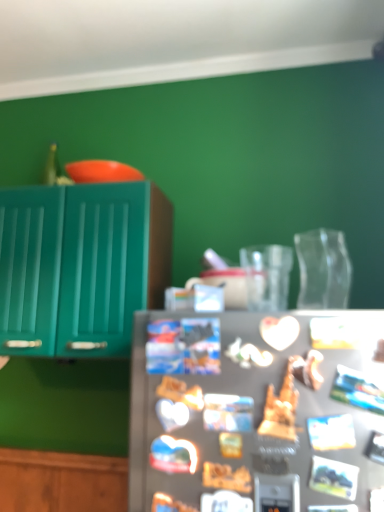
Question: Considering the positions of teal glossy cabinet at left and satin silver fridge at center in the image, is teal glossy cabinet at left bigger or smaller than satin silver fridge at center?

Choices:
 (A) small
 (B) big

Answer: (B)

Question: From the image's perspective, relative to satin silver fridge at center, is teal glossy cabinet at left above or below?

Choices:
 (A) below
 (B) above

Answer: (B)

Question: Estimate the real-world distances between objects in this image. Which object is farther from the satin silver refrigerator at center?

Choices:
 (A) teal glossy cabinet at left
 (B) satin silver fridge at center

Answer: (A)

Question: Estimate the real-world distances between objects in this image. Which object is farther from the satin silver refrigerator at center?

Choices:
 (A) satin silver fridge at center
 (B) teal glossy cabinet at left

Answer: (B)